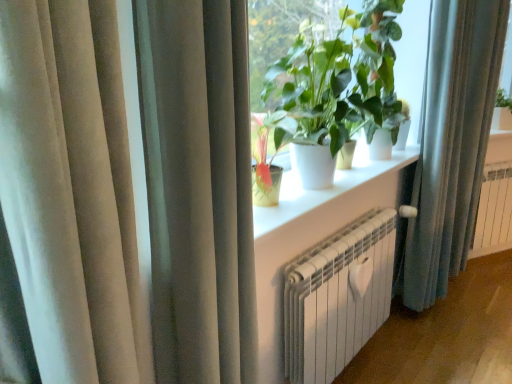
Question: From the image's perspective, relative to white matte window sill at center, is satin beige curtain at left, the first curtain when ordered from front to back, above or below?

Choices:
 (A) below
 (B) above

Answer: (A)

Question: In terms of size, does satin beige curtain at left, the first curtain when ordered from front to back, appear bigger or smaller than white matte window sill at center?

Choices:
 (A) small
 (B) big

Answer: (B)

Question: Which is farther from the green matte plant at upper center?

Choices:
 (A) blue fabric curtain at right, which is counted as the first curtain, starting from the right
 (B) satin beige curtain at left, the 1th curtain when ordered from left to right
 (C) white matte window sill at center
 (D) white metallic radiator at lower center
 (E) white metallic radiator at right

Answer: (E)

Question: Which is farther from the green matte plant at upper center?

Choices:
 (A) white matte window sill at center
 (B) satin beige curtain at left, the 1th curtain when ordered from left to right
 (C) white metallic radiator at lower center
 (D) white metallic radiator at right
 (E) blue fabric curtain at right, placed as the first curtain when sorted from back to front

Answer: (D)